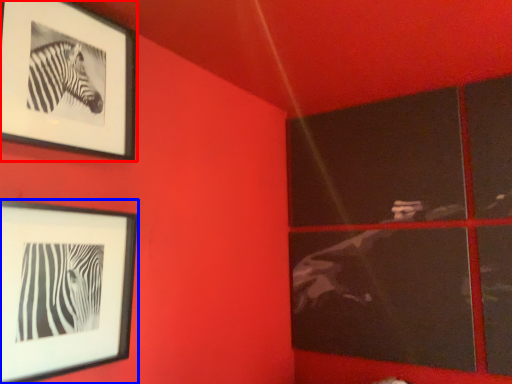
Question: Which object appears farthest to the camera in this image, picture frame (highlighted by a red box) or picture frame (highlighted by a blue box)?

Choices:
 (A) picture frame
 (B) picture frame

Answer: (A)